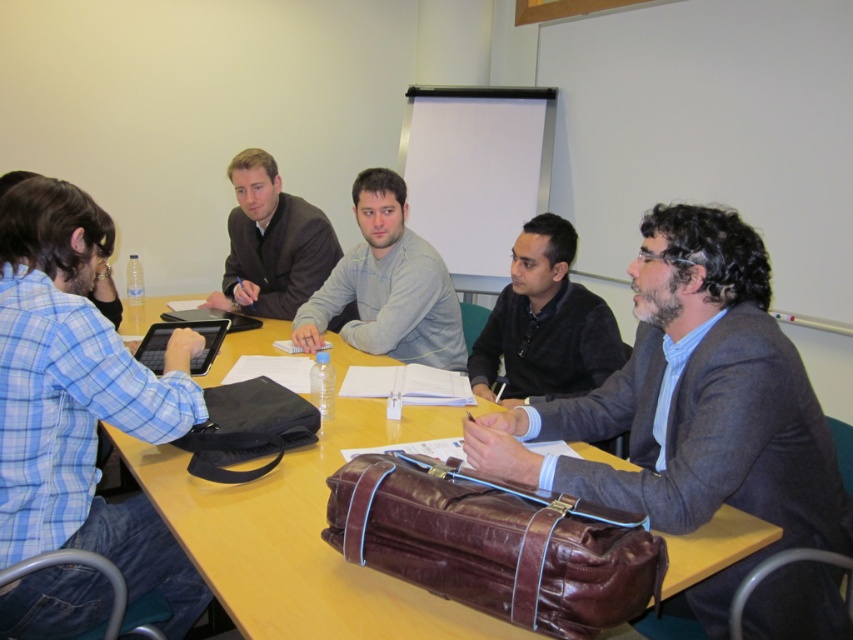
You are organizing a presentation and need to hang a 1.2 meter wide banner on the wall behind the black matte jacket at center and the matte black suit at upper center. Based on their widths, which object should you position the banner closer to to ensure it doesn

The matte black suit at upper center is wider than the black matte jacket at center, so positioning the banner closer to the matte black suit at upper center would provide a better fit since it can accommodate the wider width of the banner.

In the scene shown: You are organizing a meeting and need to place a 1.2 meter wide whiteboard between the leather briefcase at lower right and the black matte jacket at center on the table. Can the whiteboard fit between them based on their current positions?

The leather briefcase at lower right is wider than the black matte jacket at center. However, the combined width of both objects is not provided. Without knowing their exact positions and spacing between them, it is impossible to determine if the 1.2 meter whiteboard can fit between them.